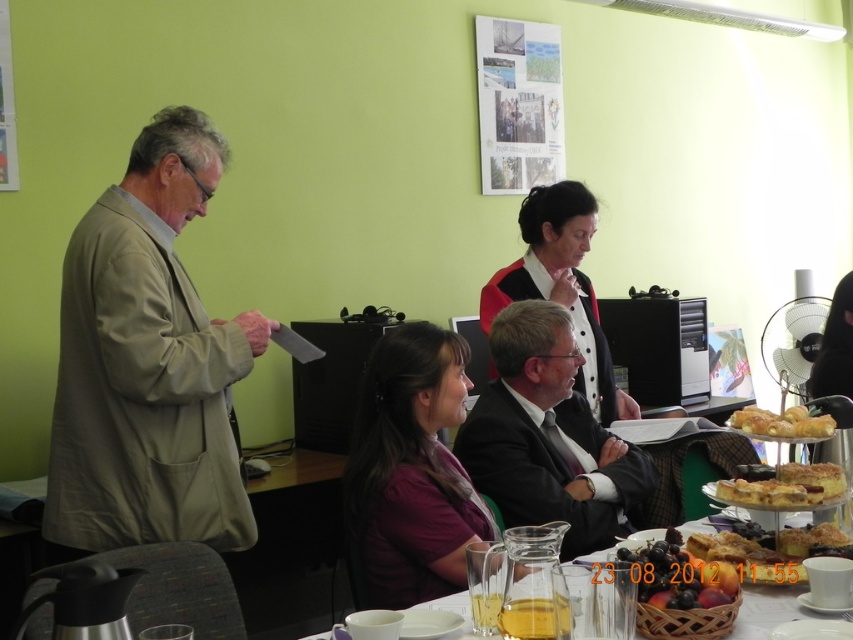
Question: Can you confirm if dark suit at center is positioned below golden croissant at right?

Choices:
 (A) yes
 (B) no

Answer: (A)

Question: Can you confirm if khaki fabric jacket at left is thinner than dark suit at center?

Choices:
 (A) yes
 (B) no

Answer: (B)

Question: Does translucent glass pitcher at lower center appear on the left side of golden crumbly cake at lower right?

Choices:
 (A) no
 (B) yes

Answer: (B)

Question: Which object is closer to the camera taking this photo?

Choices:
 (A) golden brown cake at lower right
 (B) golden croissant at right

Answer: (A)

Question: Estimate the real-world distances between objects in this image. Which object is farther from the golden croissant at right?

Choices:
 (A) translucent glass pitcher at lower center
 (B) golden brown cake at lower right
 (C) khaki fabric jacket at left
 (D) dark suit at center

Answer: (C)

Question: Which point appears farthest from the camera in this image?

Choices:
 (A) (801, 573)
 (B) (810, 541)

Answer: (B)